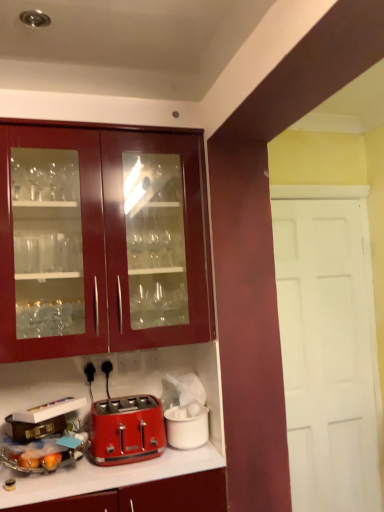
Question: Considering the relative sizes of matte red toaster at lower left, which is the second appliance from right to left, and brown leather suitcase at lower left, placed as the 3th appliance when sorted from right to left, in the image provided, is matte red toaster at lower left, which is the second appliance from right to left, wider than brown leather suitcase at lower left, placed as the 3th appliance when sorted from right to left,?

Choices:
 (A) yes
 (B) no

Answer: (A)

Question: Does matte red toaster at lower left, which is counted as the second appliance, starting from the left, have a greater height compared to brown leather suitcase at lower left, the first appliance from the left?

Choices:
 (A) no
 (B) yes

Answer: (B)

Question: Is matte red toaster at lower left, which is counted as the second appliance, starting from the left, positioned with its back to brown leather suitcase at lower left, the first appliance from the left?

Choices:
 (A) no
 (B) yes

Answer: (A)

Question: Is matte red toaster at lower left, which is the second appliance from right to left, shorter than brown leather suitcase at lower left, the first appliance from the left?

Choices:
 (A) yes
 (B) no

Answer: (B)

Question: From a real-world perspective, does matte red toaster at lower left, which is the second appliance from right to left, stand above brown leather suitcase at lower left, placed as the 3th appliance when sorted from right to left?

Choices:
 (A) yes
 (B) no

Answer: (B)

Question: In terms of size, does brown leather suitcase at lower left, placed as the 3th appliance when sorted from right to left, appear bigger or smaller than glossy wood cabinet at upper left?

Choices:
 (A) small
 (B) big

Answer: (A)

Question: In the image, is brown leather suitcase at lower left, placed as the 3th appliance when sorted from right to left, on the left side or the right side of glossy wood cabinet at upper left?

Choices:
 (A) left
 (B) right

Answer: (A)

Question: From the image's perspective, is brown leather suitcase at lower left, the first appliance from the left, above or below glossy wood cabinet at upper left?

Choices:
 (A) above
 (B) below

Answer: (B)

Question: From their relative heights in the image, would you say brown leather suitcase at lower left, placed as the 3th appliance when sorted from right to left, is taller or shorter than glossy wood cabinet at upper left?

Choices:
 (A) tall
 (B) short

Answer: (B)

Question: In terms of height, does matte red toaster at lower left, which is the second appliance from right to left, look taller or shorter compared to brown leather suitcase at lower left, placed as the 3th appliance when sorted from right to left?

Choices:
 (A) short
 (B) tall

Answer: (B)

Question: Would you say matte red toaster at lower left, which is the second appliance from right to left, is to the left or to the right of brown leather suitcase at lower left, placed as the 3th appliance when sorted from right to left, in the picture?

Choices:
 (A) left
 (B) right

Answer: (B)

Question: From a real-world perspective, is matte red toaster at lower left, which is counted as the second appliance, starting from the left, positioned above or below brown leather suitcase at lower left, placed as the 3th appliance when sorted from right to left?

Choices:
 (A) above
 (B) below

Answer: (B)

Question: From the image's perspective, is matte red toaster at lower left, which is counted as the second appliance, starting from the left, above or below brown leather suitcase at lower left, placed as the 3th appliance when sorted from right to left?

Choices:
 (A) below
 (B) above

Answer: (A)

Question: Visually, is white matte ice bucket at lower center, which ranks as the 1th appliance in right-to-left order, positioned to the left or to the right of shiny red toaster at lower center?

Choices:
 (A) right
 (B) left

Answer: (A)

Question: From the image's perspective, is white matte ice bucket at lower center, which appears as the third appliance when viewed from the left, positioned above or below shiny red toaster at lower center?

Choices:
 (A) below
 (B) above

Answer: (A)